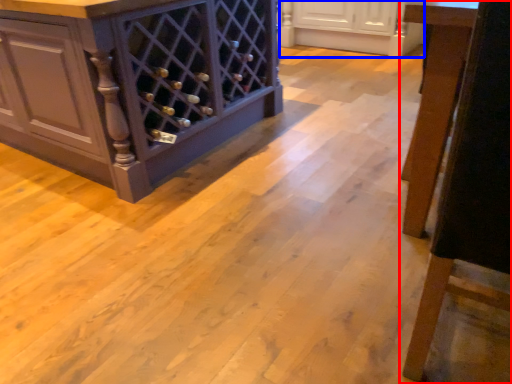
Question: Which of the following is the closest to the observer, furniture (highlighted by a red box) or cabinetry (highlighted by a blue box)?

Choices:
 (A) furniture
 (B) cabinetry

Answer: (A)